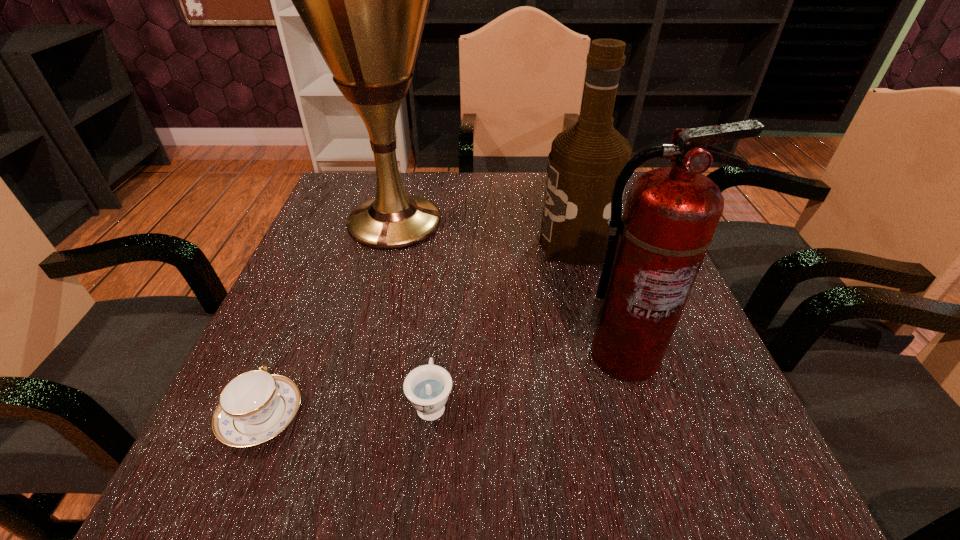
The height and width of the screenshot is (540, 960). I want to click on vacant region at the near right corner, so click(x=763, y=484).

Where is `vacant area that lies between the fire extinguisher and the right teacup`? vacant area that lies between the fire extinguisher and the right teacup is located at coordinates (527, 379).

Locate an element on the screen. free area in between the left teacup and the alcohol is located at coordinates (419, 330).

This screenshot has height=540, width=960. Find the location of `vacant region between the right teacup and the tallest object`. vacant region between the right teacup and the tallest object is located at coordinates (413, 313).

I want to click on blank region between the left teacup and the alcohol, so click(419, 330).

Where is `empty location between the trophy cup and the left teacup`? The width and height of the screenshot is (960, 540). empty location between the trophy cup and the left teacup is located at coordinates (328, 320).

I want to click on vacant point located between the right teacup and the left teacup, so click(347, 409).

I want to click on object that is the closest to the alcohol, so click(654, 252).

Where is `object that is the fourth closest to the tallest object`? The image size is (960, 540). object that is the fourth closest to the tallest object is located at coordinates (255, 406).